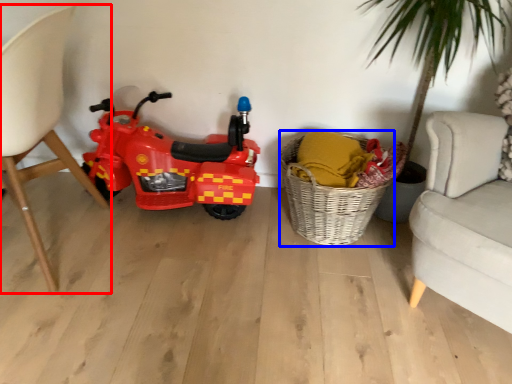
Question: Which object appears farthest to the camera in this image, chair (highlighted by a red box) or basket (highlighted by a blue box)?

Choices:
 (A) chair
 (B) basket

Answer: (B)